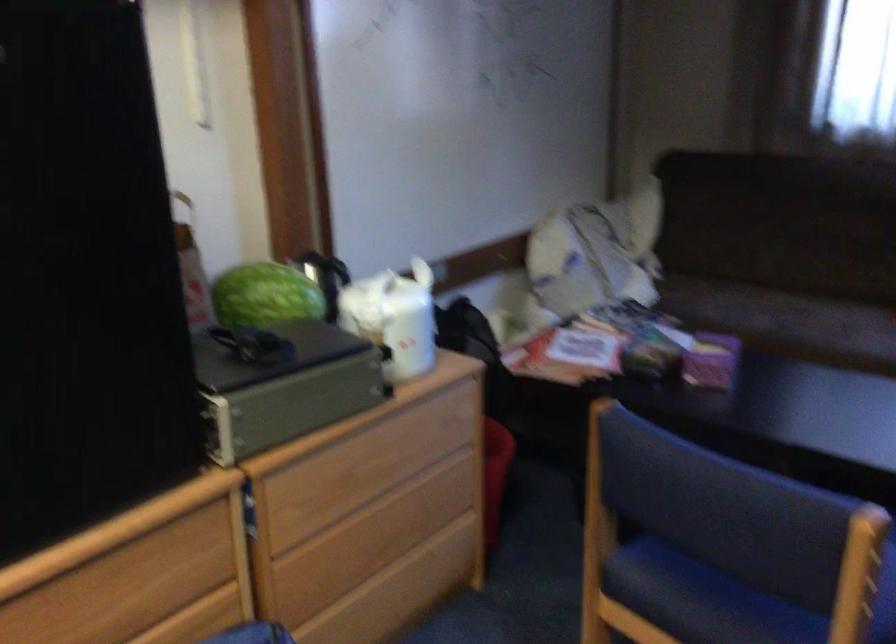
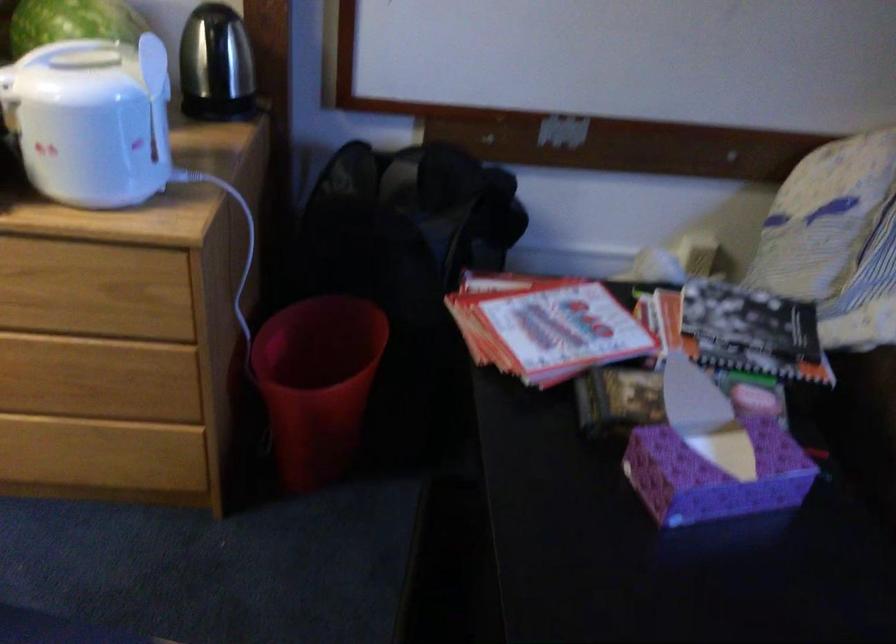
In the second image, find the point that corresponds to (x=417, y=298) in the first image.

(156, 97)